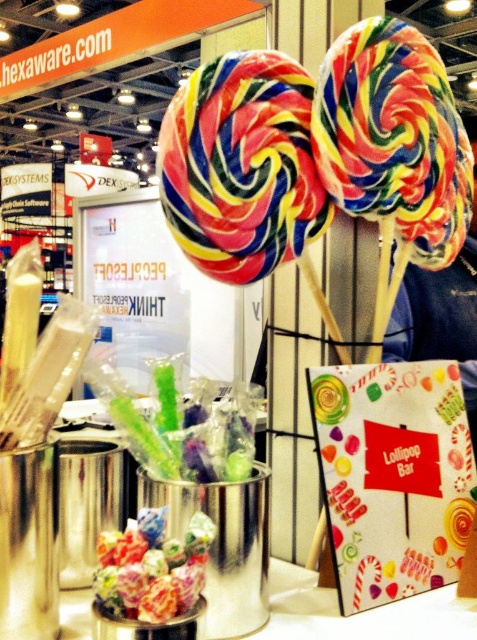
Question: Which of the following is the farthest from the observer?

Choices:
 (A) (209, 152)
 (B) (107, 541)

Answer: (A)

Question: Is multicolored spiral lollipop at center thinner than translucent plastic lollipops at center?

Choices:
 (A) yes
 (B) no

Answer: (B)

Question: Which point is closer to the camera?

Choices:
 (A) multicolored spiral lollipop at center
 (B) swirled sugar lollipop at center
 (C) translucent plastic lollipops at center

Answer: (C)

Question: Can you confirm if multicolored spiral lollipop at center is thinner than translucent plastic lollipops at center?

Choices:
 (A) yes
 (B) no

Answer: (B)

Question: Where is swirled sugar lollipop at center located in relation to translucent plastic lollipops at center in the image?

Choices:
 (A) right
 (B) left

Answer: (A)

Question: Which of the following is the closest to the observer?

Choices:
 (A) (201, 244)
 (B) (331, 115)
 (C) (146, 593)

Answer: (C)